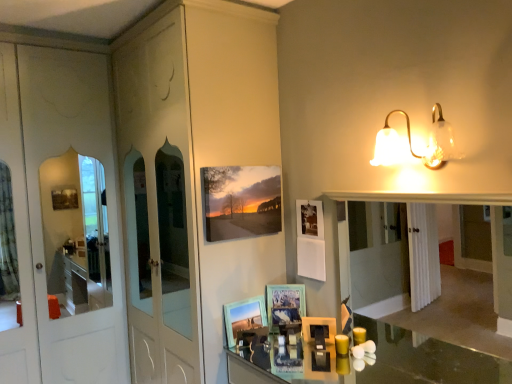
Question: Can you confirm if matte canvas print at upper center, the third picture frame ordered from the bottom, is shorter than clear glass mirror at center?

Choices:
 (A) no
 (B) yes

Answer: (B)

Question: Does matte canvas print at upper center, the third picture frame ordered from the bottom, have a lesser width compared to clear glass mirror at center?

Choices:
 (A) no
 (B) yes

Answer: (B)

Question: Is the position of matte canvas print at upper center, the third picture frame ordered from the bottom, more distant than that of clear glass mirror at center?

Choices:
 (A) yes
 (B) no

Answer: (A)

Question: Is matte canvas print at upper center, the third picture frame ordered from the bottom, outside clear glass mirror at center?

Choices:
 (A) yes
 (B) no

Answer: (A)

Question: Is matte canvas print at upper center, which is counted as the first picture frame, starting from the top, bigger than clear glass mirror at center?

Choices:
 (A) no
 (B) yes

Answer: (A)

Question: From the image's perspective, is matte canvas print at upper center, the third picture frame ordered from the bottom, over clear glass mirror at center?

Choices:
 (A) yes
 (B) no

Answer: (A)

Question: Can you confirm if clear glass mirror at center is positioned to the right of wooden picture frame at center, the 2th picture frame from the top?

Choices:
 (A) yes
 (B) no

Answer: (A)

Question: From the image's perspective, would you say clear glass mirror at center is shown under wooden picture frame at center, the 2th picture frame from the top?

Choices:
 (A) yes
 (B) no

Answer: (B)

Question: Is clear glass mirror at center next to wooden picture frame at center, the 2th picture frame from the top, and touching it?

Choices:
 (A) no
 (B) yes

Answer: (A)

Question: Is clear glass mirror at center thinner than wooden picture frame at center, the second picture frame when ordered from bottom to top?

Choices:
 (A) no
 (B) yes

Answer: (A)

Question: Is clear glass mirror at center smaller than wooden picture frame at center, the second picture frame when ordered from bottom to top?

Choices:
 (A) no
 (B) yes

Answer: (A)

Question: Is clear glass mirror at center oriented towards wooden picture frame at center, the second picture frame when ordered from bottom to top?

Choices:
 (A) yes
 (B) no

Answer: (B)

Question: Is there a large distance between matte canvas print at upper center, which is counted as the first picture frame, starting from the top, and wooden picture frame at center, which appears as the 1th picture frame when ordered from the bottom?

Choices:
 (A) yes
 (B) no

Answer: (B)